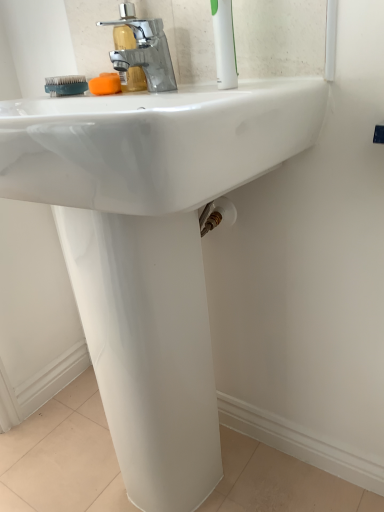
Question: Is teal rubber brush at upper left bigger or smaller than orange sponge at upper center?

Choices:
 (A) small
 (B) big

Answer: (B)

Question: In terms of height, does teal rubber brush at upper left look taller or shorter compared to orange sponge at upper center?

Choices:
 (A) tall
 (B) short

Answer: (A)

Question: Which of these objects is positioned closest to the teal rubber brush at upper left?

Choices:
 (A) orange sponge at upper center
 (B) white plastic toothbrush at upper right
 (C) polished chrome faucet at upper center

Answer: (A)

Question: Which object is positioned closest to the polished chrome faucet at upper center?

Choices:
 (A) orange sponge at upper center
 (B) white plastic toothbrush at upper right
 (C) teal rubber brush at upper left

Answer: (A)